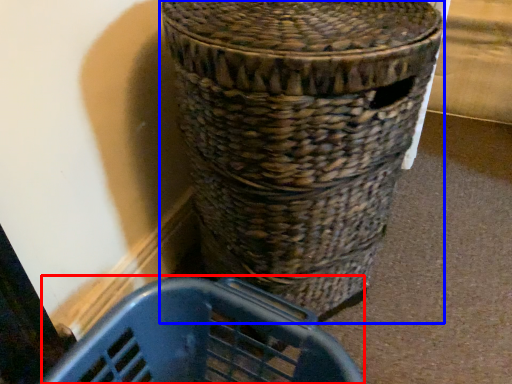
Question: Which of the following is the farthest to the observer, basket container (highlighted by a red box) or waste container (highlighted by a blue box)?

Choices:
 (A) basket container
 (B) waste container

Answer: (A)